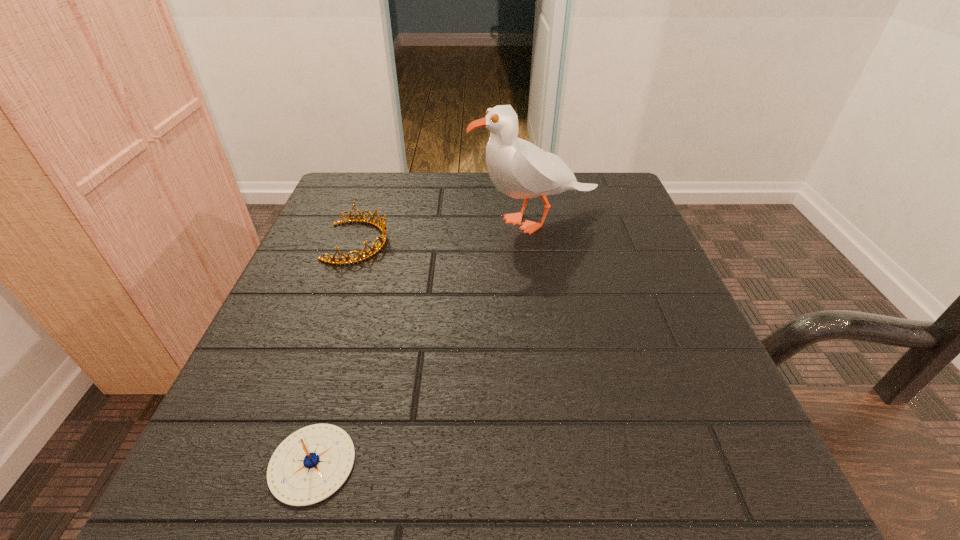
This screenshot has width=960, height=540. What are the coordinates of `vacant space at the near edge of the desktop` in the screenshot? It's located at (561, 490).

Find the location of a particular element. vacant space at the left edge of the desktop is located at coordinates (324, 323).

I want to click on vacant space at the right edge, so click(x=605, y=350).

At what (x,y) coordinates should I click in order to perform the action: click on free spot at the far left corner of the desktop. Please return your answer as a coordinate pair (x, y). Looking at the image, I should click on (384, 194).

Where is `free region at the near left corner of the desktop`? The height and width of the screenshot is (540, 960). free region at the near left corner of the desktop is located at coordinates (x=200, y=457).

This screenshot has height=540, width=960. In the image, there is a desktop. In order to click on vacant space at the far right corner in this screenshot , I will do `click(638, 211)`.

You are a GUI agent. You are given a task and a screenshot of the screen. Output one action in this format:
    pyautogui.click(x=<x>, y=<y>)
    Task: Click on the empty location between the tallest object and the tiara
    This screenshot has width=960, height=540.
    Given the screenshot: What is the action you would take?
    pyautogui.click(x=446, y=232)

At what (x,y) coordinates should I click in order to perform the action: click on free space between the tiara and the nearest object. Please return your answer as a coordinate pair (x, y). The width and height of the screenshot is (960, 540). Looking at the image, I should click on (335, 353).

You are a GUI agent. You are given a task and a screenshot of the screen. Output one action in this format:
    pyautogui.click(x=<x>, y=<y>)
    Task: Click on the blank region between the nearest object and the rightmost object
    The height and width of the screenshot is (540, 960).
    Given the screenshot: What is the action you would take?
    pyautogui.click(x=423, y=342)

I want to click on blank region between the tiara and the rightmost object, so click(446, 232).